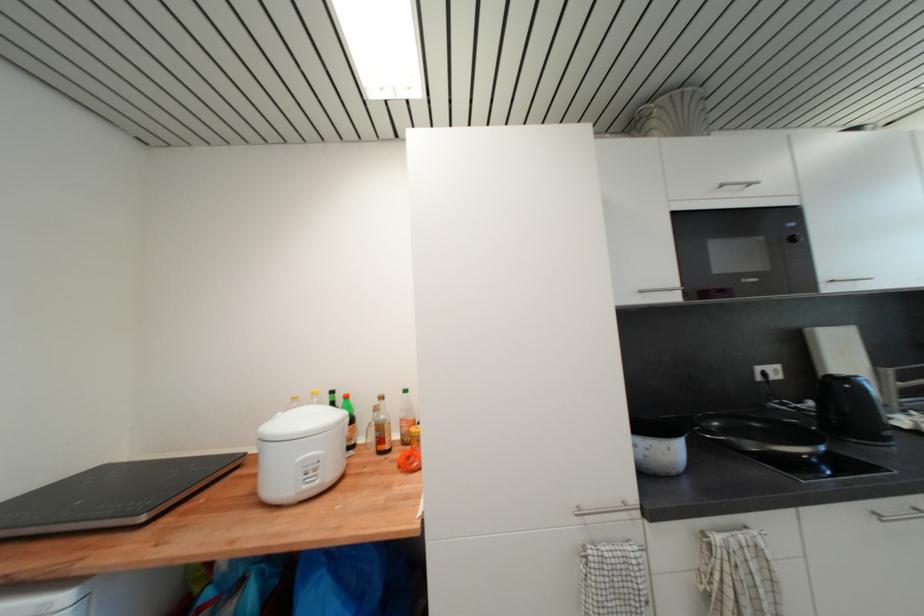
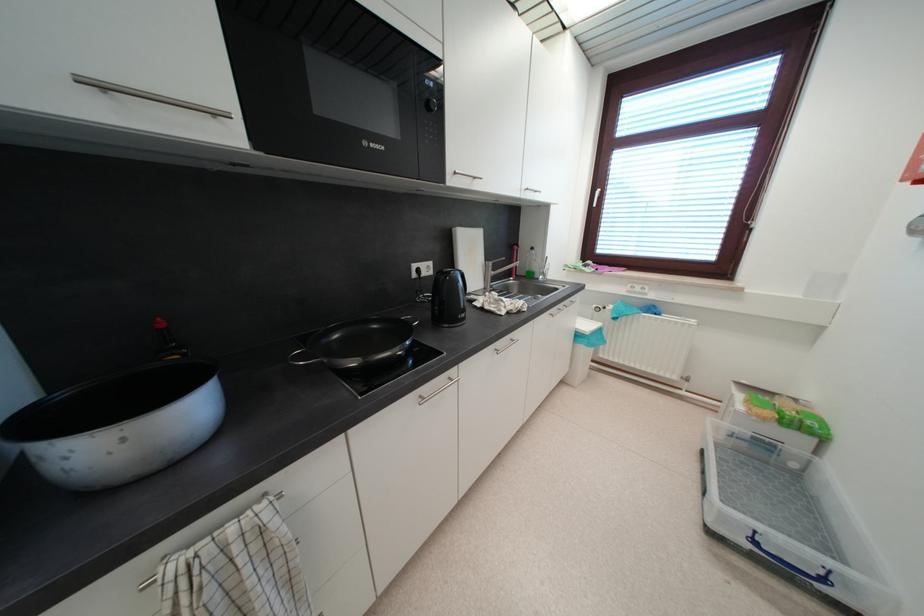
The point at (881, 516) is marked in the first image. Where is the corresponding point in the second image?

(427, 400)